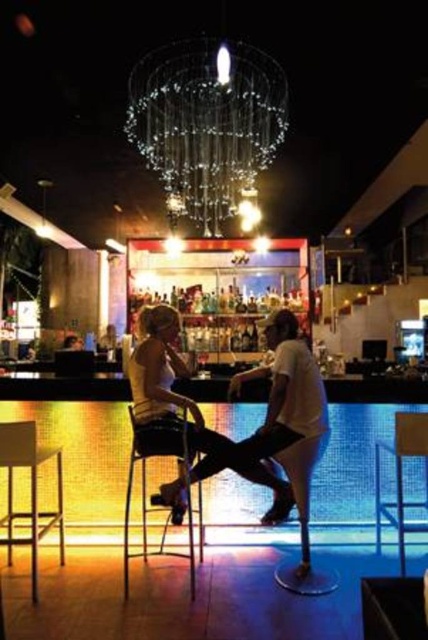
You are a bartender standing at the bar counter. You need to adjust the clear glass chandelier at upper center and the matte white shirt at center. Which object is closer to you?

The matte white shirt at center is closer to you because the clear glass chandelier at upper center is further to the viewer than the matte white shirt at center.

You are a bartender who needs to reach a bottle on the shelf behind you without bumping into the clear glass chandelier at upper center or the matte white shirt at center. The space between them is 6.13 feet. Can you safely walk through this space if you need 2 feet of clearance on all sides?

The distance between the clear glass chandelier at upper center and the matte white shirt at center is 6.13 feet. To ensure 2 feet of clearance on all sides, the required space would be 6.13 minus 2 feet on each side, totaling 2.0 feet needed. Since 6.13 feet minus 4 feet equals 2.13 feet remaining, there is enough space for the bartender to move safely through the area.

You are a bartender who needs to replace a light bulb in the clear glass chandelier at upper center. You have a ladder that reaches 1.8 meters. The metallic silver bar stool at lower left is 0.8 meters tall. Can you safely reach the chandelier using the ladder and the bar stool combined?

The clear glass chandelier at upper center is not as tall as the metallic silver bar stool at lower left. Since the bar stool is 0.8 meters tall and the ladder reaches 1.8 meters, combined they can reach up to 2.6 meters. If the chandelier is shorter than the bar stool, it would be even lower than 0.8 meters, so the ladder alone or even without the ladder might be sufficient. However, the exact height of the chandelier isn